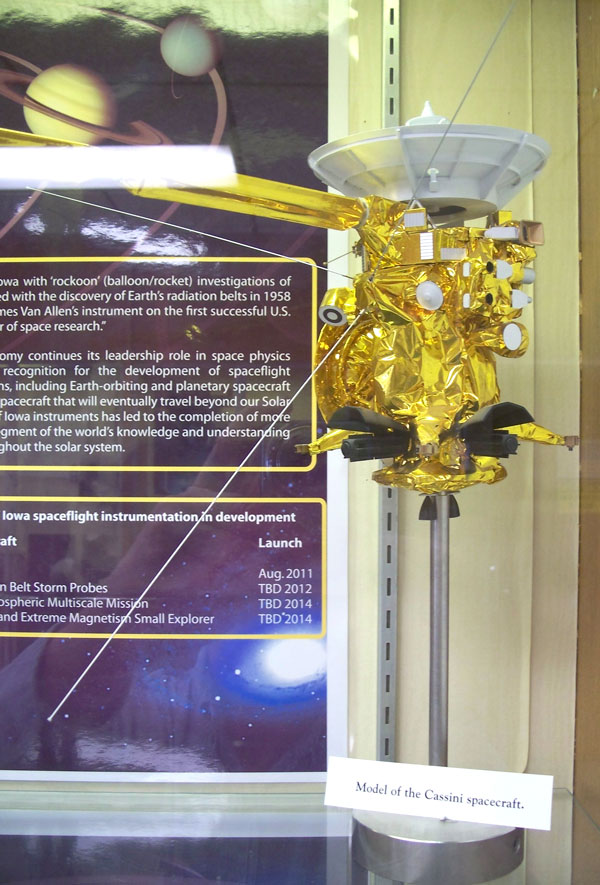
Locate an element on the screen. This screenshot has width=600, height=885. glass table is located at coordinates (538, 851).